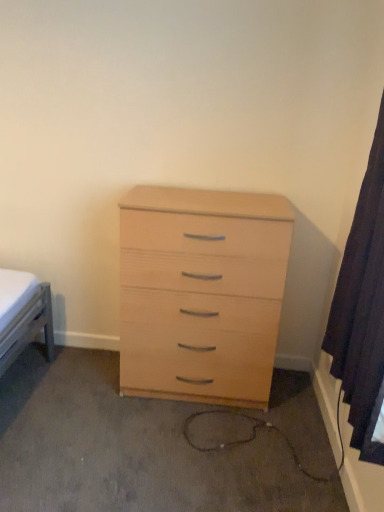
I want to click on vacant space to the right of light wood chest of drawers at center, so click(x=291, y=409).